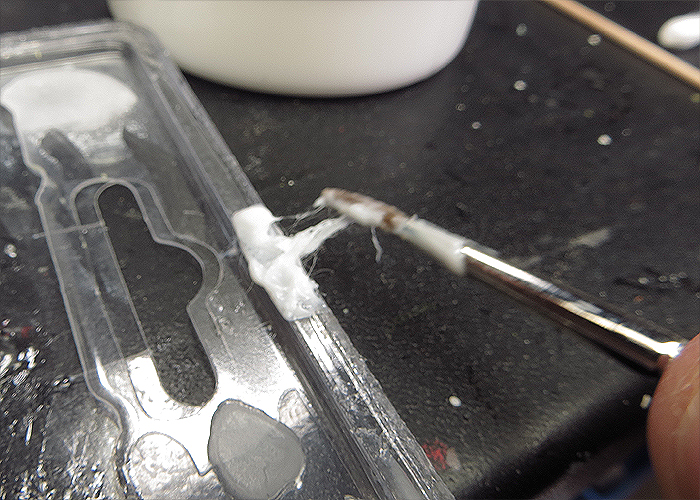
Image resolution: width=700 pixels, height=500 pixels. Identify the location of table edge. (566, 440).